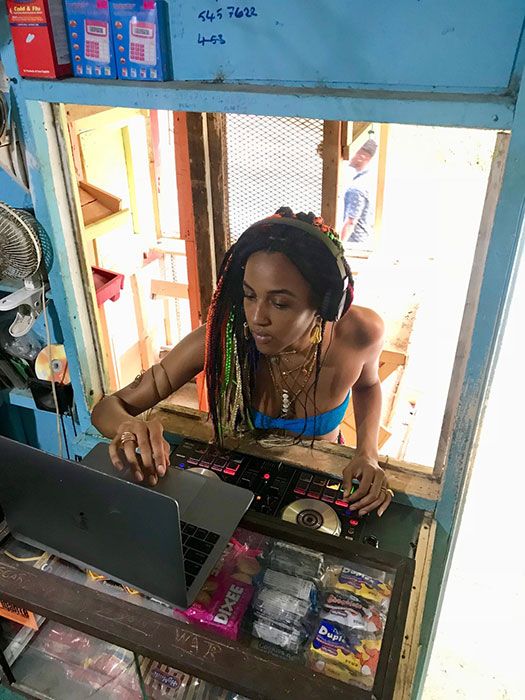
Find the location of a particular element. Image resolution: width=525 pixels, height=700 pixels. fan is located at coordinates (20, 255).